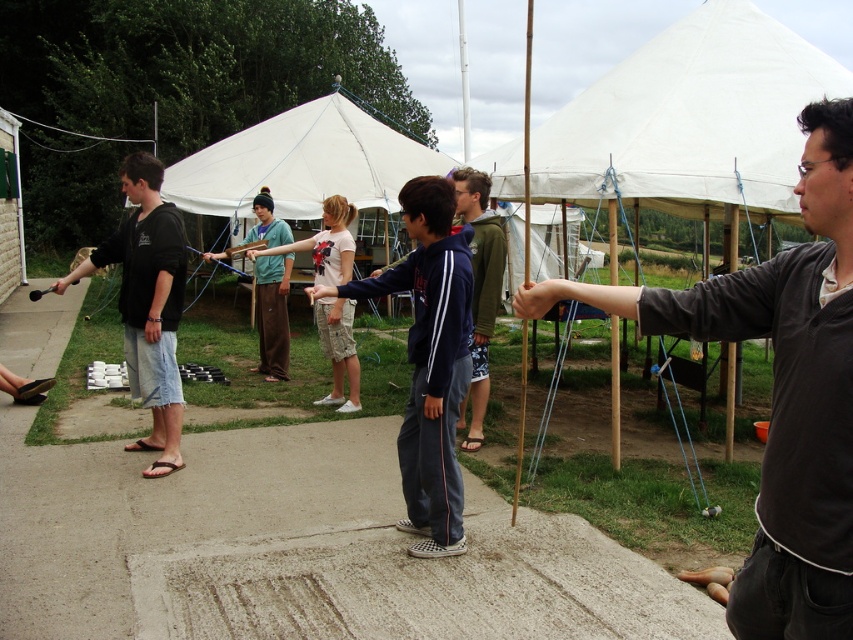
Question: Is green matte jacket at center thinner than brushed metal stick at center?

Choices:
 (A) no
 (B) yes

Answer: (B)

Question: Which point is farther from the camera taking this photo?

Choices:
 (A) (276, 380)
 (B) (744, 106)
 (C) (320, 317)

Answer: (A)

Question: Which object is positioned farthest from the white cotton shirt at center?

Choices:
 (A) brushed metal stick at center
 (B) white canvas canopy at upper center
 (C) navy blue hoodie at center

Answer: (B)

Question: Which point appears farthest from the camera in this image?

Choices:
 (A) (276, 340)
 (B) (810, 424)

Answer: (A)

Question: Does green matte jacket at center appear on the left side of white cotton shirt at center?

Choices:
 (A) yes
 (B) no

Answer: (B)

Question: Is navy blue hoodie at center wider than white cotton shirt at center?

Choices:
 (A) no
 (B) yes

Answer: (A)